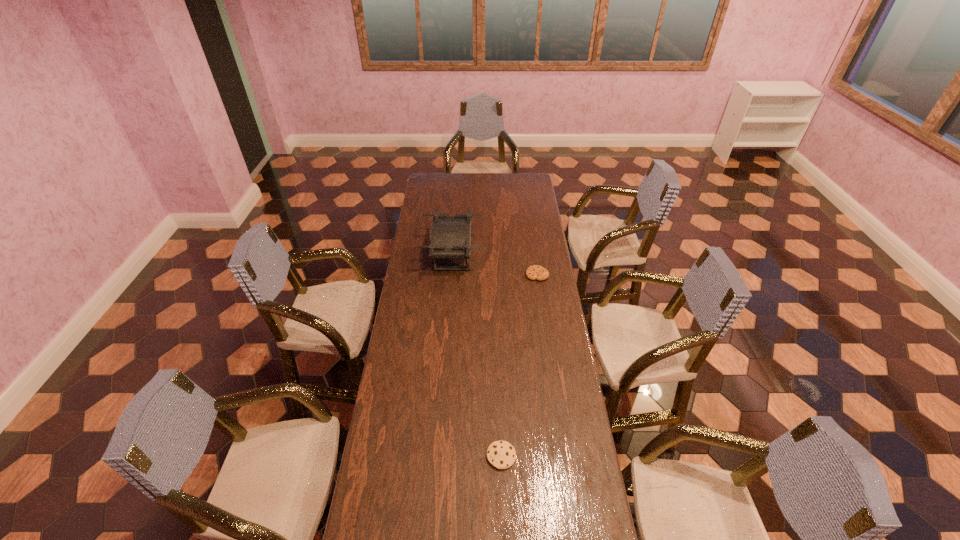
I want to click on object that is at the right edge, so click(535, 272).

Identify the location of vacant space at the far edge of the desktop. (486, 180).

In the image, there is a desktop. At what (x,y) coordinates should I click in order to perform the action: click on free space at the left edge. Please return your answer as a coordinate pair (x, y). The width and height of the screenshot is (960, 540). Looking at the image, I should click on (429, 316).

In the image, there is a desktop. Identify the location of vacant space at the right edge. (587, 512).

The width and height of the screenshot is (960, 540). Identify the location of vacant point at the far right corner. (516, 174).

In order to click on vacant point located between the tallest object and the farther cookie in this screenshot , I will do `click(494, 266)`.

Where is `free space between the farther cookie and the nearest object`? free space between the farther cookie and the nearest object is located at coordinates (519, 366).

Find the location of `free area in between the right cookie and the nearest object`. free area in between the right cookie and the nearest object is located at coordinates (519, 366).

Identify the location of free area in between the tallest object and the left cookie. The height and width of the screenshot is (540, 960). (477, 356).

Identify which object is located as the nearest to the left cookie. Please provide its 2D coordinates. Your answer should be formatted as a tuple, i.e. [(x, y)], where the tuple contains the x and y coordinates of a point satisfying the conditions above.

[(450, 236)]